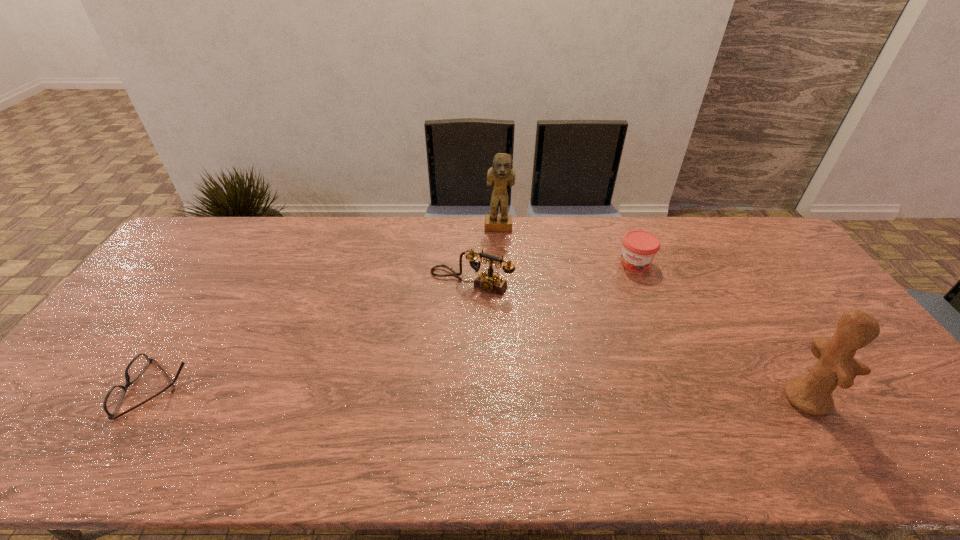
Select which object appears as the fourth closest to the farthest object. Please provide its 2D coordinates. Your answer should be formatted as a tuple, i.e. [(x, y)], where the tuple contains the x and y coordinates of a point satisfying the conditions above.

[(113, 399)]

Locate an element on the screen. This screenshot has height=540, width=960. object that is the third closest to the second shortest object is located at coordinates (836, 366).

In order to click on vacant region that satisfies the following two spatial constraints: 1. on the front side of the nearer figurine; 2. on the front-facing side of the fourth tallest object in this screenshot , I will do `click(690, 397)`.